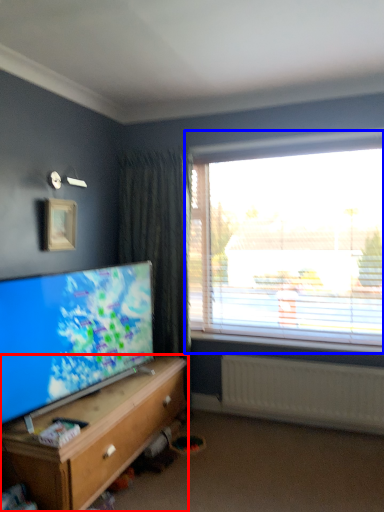
Question: Which object appears farthest to the camera in this image, cabinetry (highlighted by a red box) or window (highlighted by a blue box)?

Choices:
 (A) cabinetry
 (B) window

Answer: (B)